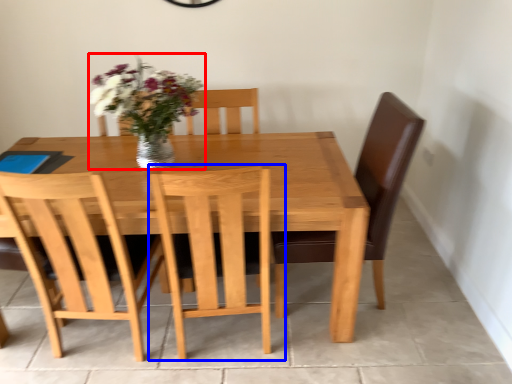
Question: Which object appears farthest to the camera in this image, floral arrangement (highlighted by a red box) or chair (highlighted by a blue box)?

Choices:
 (A) floral arrangement
 (B) chair

Answer: (A)